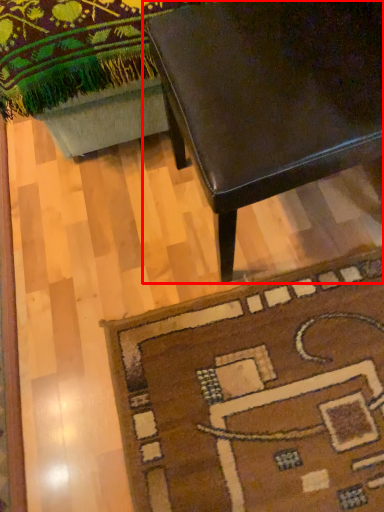
Question: From the image's perspective, what is the correct spatial relationship of table (annotated by the red box) in relation to mat?

Choices:
 (A) above
 (B) below

Answer: (A)